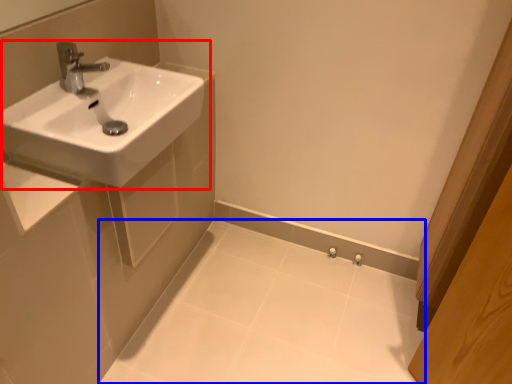
Question: Which point is further to the camera, sink (highlighted by a red box) or porcelain (highlighted by a blue box)?

Choices:
 (A) sink
 (B) porcelain

Answer: (B)